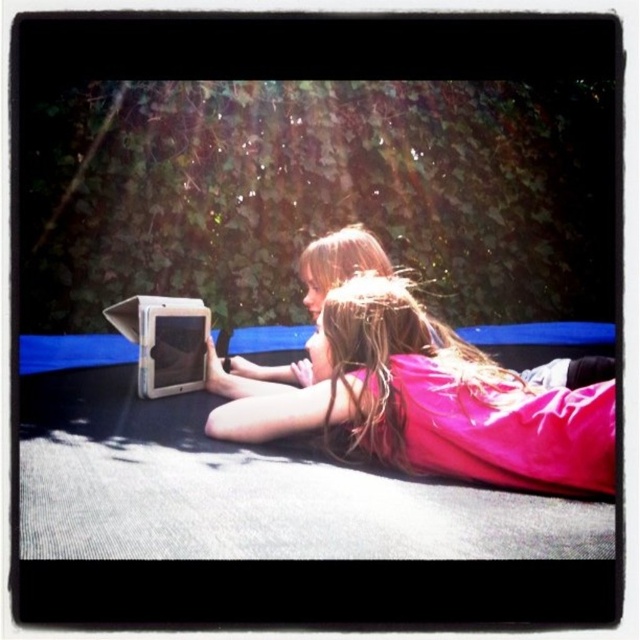
Question: Among these points, which one is farthest from the camera?

Choices:
 (A) (307, 252)
 (B) (163, 388)
 (C) (364, 289)

Answer: (A)

Question: Can you confirm if pink satin dress at center is smaller than matte white laptop at center?

Choices:
 (A) no
 (B) yes

Answer: (A)

Question: Does pink fabric at center appear on the right side of matte white laptop at center?

Choices:
 (A) no
 (B) yes

Answer: (B)

Question: Which of the following is the farthest from the observer?

Choices:
 (A) (467, 458)
 (B) (164, 316)
 (C) (609, 372)

Answer: (B)

Question: Based on their relative distances, which object is nearer to the pink fabric at center?

Choices:
 (A) matte white laptop at center
 (B) pink satin dress at center

Answer: (B)

Question: In this image, where is pink satin dress at center located relative to matte white laptop at center?

Choices:
 (A) above
 (B) below

Answer: (A)